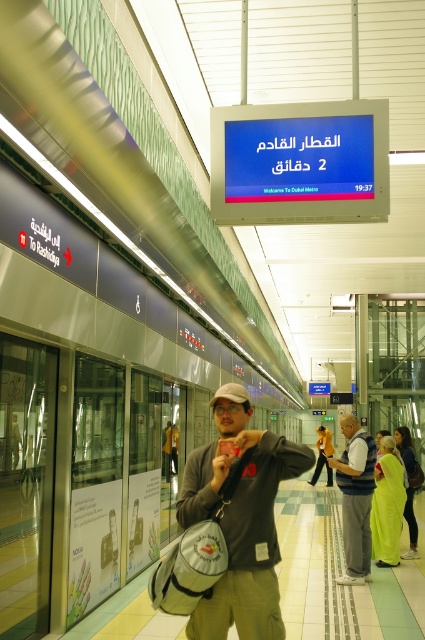
Question: Which point is farther from the camera taking this photo?

Choices:
 (A) (257, 504)
 (B) (402, 468)

Answer: (B)

Question: Does khaki cotton pants at center appear on the left side of light green fabric dress at center?

Choices:
 (A) no
 (B) yes

Answer: (B)

Question: Which point is farther to the camera?

Choices:
 (A) (368, 500)
 (B) (373, 548)
 (C) (217, 612)

Answer: (B)

Question: Among these points, which one is nearest to the camera?

Choices:
 (A) pos(387,538)
 (B) pos(408,429)
 (C) pos(363,573)
 (D) pos(206,602)

Answer: (D)

Question: Can you confirm if green silk saree at center is positioned above light green fabric dress at center?

Choices:
 (A) yes
 (B) no

Answer: (A)

Question: Can you confirm if khaki cotton pants at center is thinner than gray fabric vest at center?

Choices:
 (A) yes
 (B) no

Answer: (B)